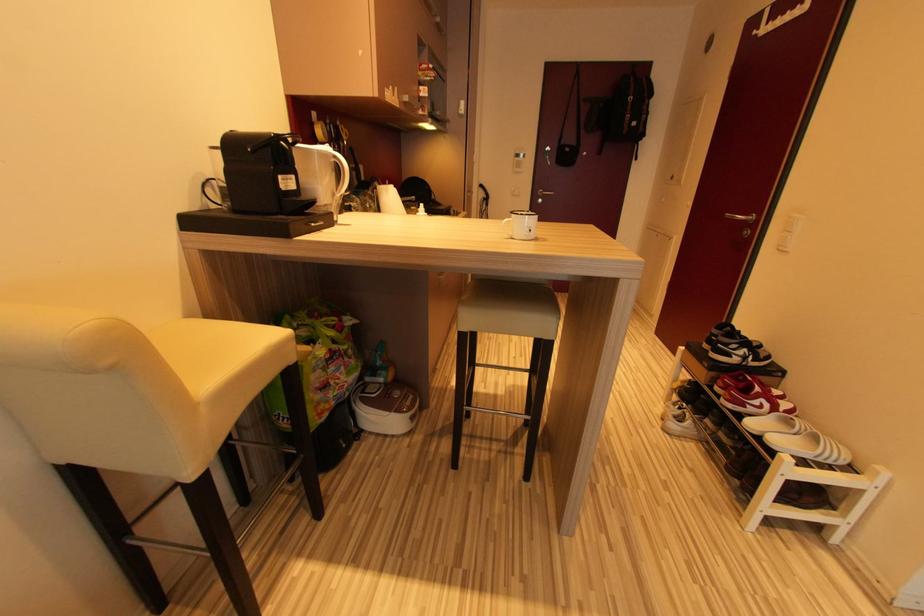
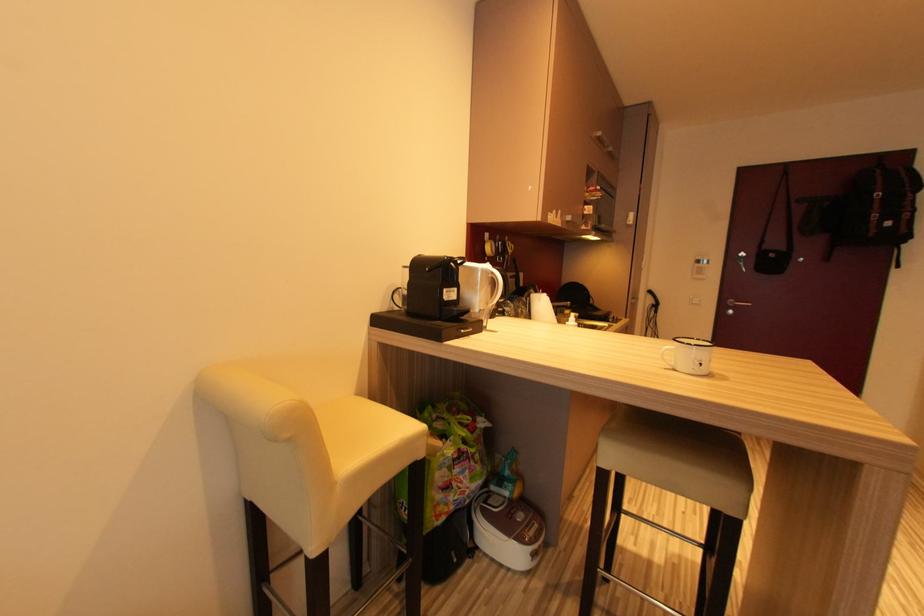
Question: The images are taken continuously from a first-person perspective. In which direction is your viewpoint rotating?

Choices:
 (A) Left
 (B) Right
 (C) Up
 (D) Down

Answer: (A)